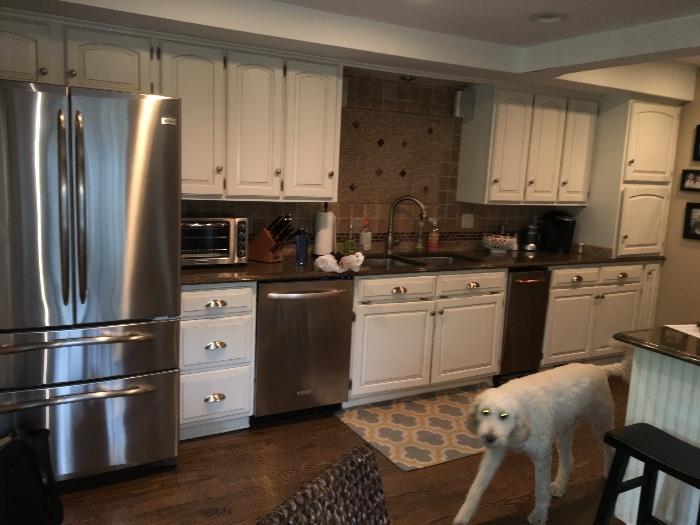
Find the location of a particular element. freezer drawer is located at coordinates (117, 420).